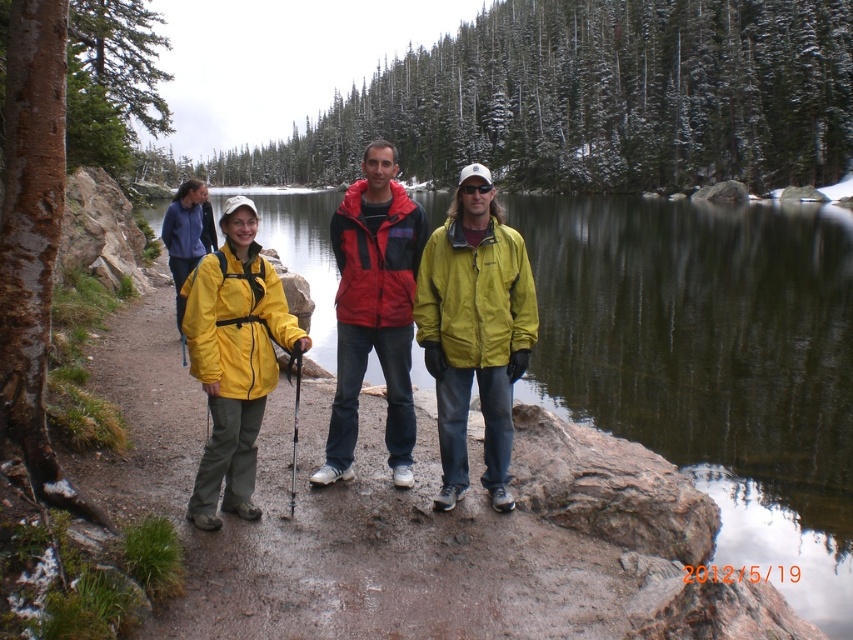
Can you confirm if transparent water at center is positioned to the left of matte yellow jacket at center?

In fact, transparent water at center is to the right of matte yellow jacket at center.

Does transparent water at center have a larger size compared to matte yellow jacket at center?

Yes, transparent water at center is bigger than matte yellow jacket at center.

Does point (611, 307) come farther from viewer compared to point (448, 346)?

Yes.

Identify the location of transparent water at center. The height and width of the screenshot is (640, 853). (712, 362).

Is yellow matte jacket at left above red/black jacket at center?

Yes.

Does yellow matte jacket at left have a lesser width compared to red/black jacket at center?

No.

Who is more forward, (225, 240) or (338, 305)?

Point (225, 240)

Identify the location of yellow matte jacket at left. The width and height of the screenshot is (853, 640). (234, 358).

Which of these two, transparent water at center or yellow matte jacket at left, stands shorter?

Standing shorter between the two is yellow matte jacket at left.

Measure the distance between transparent water at center and camera.

transparent water at center is 43.39 feet away from camera.

Locate an element on the screen. The image size is (853, 640). transparent water at center is located at coordinates (712, 362).